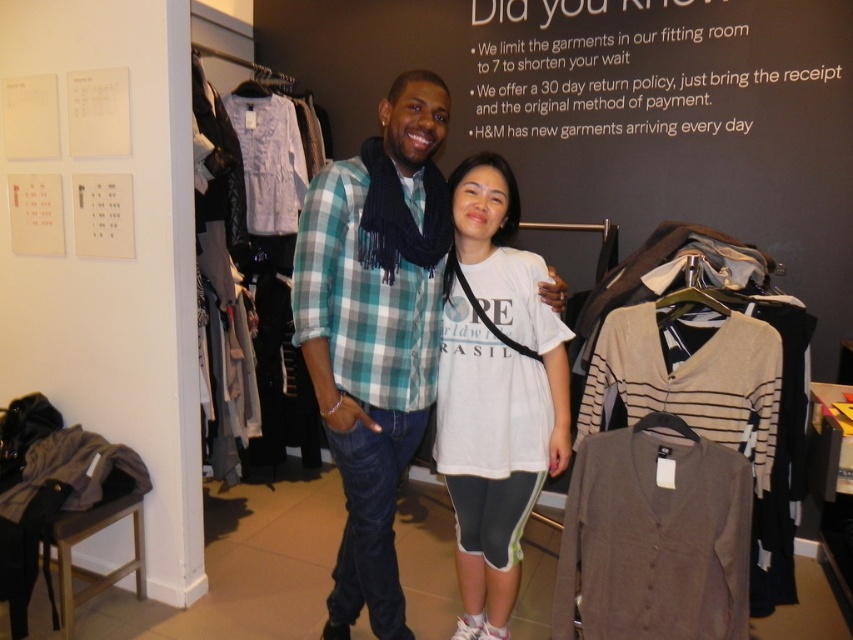
Does matte blue plaid shirt at center appear over white cotton t-shirt at center?

Yes.

Which of these two, matte blue plaid shirt at center or white cotton t-shirt at center, stands shorter?

With less height is white cotton t-shirt at center.

Does point (317, 173) lie behind point (485, 307)?

No, it is in front of (485, 307).

Identify the location of matte blue plaid shirt at center. (375, 330).

Is matte blue plaid shirt at center thinner than dark gray knit cardigan at center?

Indeed, matte blue plaid shirt at center has a lesser width compared to dark gray knit cardigan at center.

Which is below, matte blue plaid shirt at center or dark gray knit cardigan at center?

dark gray knit cardigan at center

This screenshot has height=640, width=853. In order to click on matte blue plaid shirt at center in this screenshot , I will do `click(375, 330)`.

Between white cotton t-shirt at center and dark gray knit cardigan at center, which one has more height?

Standing taller between the two is white cotton t-shirt at center.

This screenshot has width=853, height=640. In order to click on white cotton t-shirt at center in this screenshot , I will do `click(495, 394)`.